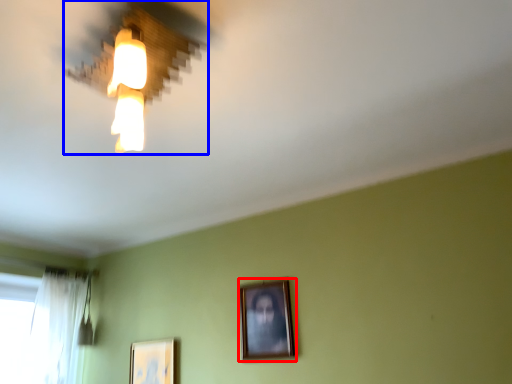
Question: Among these objects, which one is nearest to the camera, picture frame (highlighted by a red box) or lamp (highlighted by a blue box)?

Choices:
 (A) picture frame
 (B) lamp

Answer: (B)